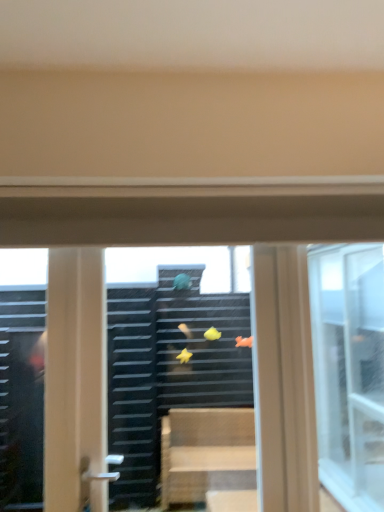
Question: Is transparent glass window at center, which ranks as the 2th window in left-to-right order, aimed at transparent glass window at center, the 1th window from the left?

Choices:
 (A) no
 (B) yes

Answer: (B)

Question: Is transparent glass window at center, acting as the first window starting from the right, touching transparent glass window at center, the 1th window from the left?

Choices:
 (A) no
 (B) yes

Answer: (A)

Question: From a real-world perspective, does transparent glass window at center, which ranks as the 2th window in left-to-right order, sit lower than transparent glass window at center, the 1th window from the left?

Choices:
 (A) no
 (B) yes

Answer: (A)

Question: Could transparent glass window at center, the 2th window from the right, be considered to be inside transparent glass window at center, acting as the first window starting from the right?

Choices:
 (A) no
 (B) yes

Answer: (A)

Question: From the image's perspective, is transparent glass window at center, acting as the first window starting from the right, located above transparent glass window at center, the 1th window from the left?

Choices:
 (A) no
 (B) yes

Answer: (B)

Question: Considering the relative sizes of transparent glass window at center, acting as the first window starting from the right, and transparent glass window at center, the 1th window from the left, in the image provided, is transparent glass window at center, acting as the first window starting from the right, bigger than transparent glass window at center, the 1th window from the left,?

Choices:
 (A) yes
 (B) no

Answer: (B)

Question: From the image's perspective, would you say transparent glass window at center, the 2th window from the right, is positioned over transparent plastic magnets at center?

Choices:
 (A) yes
 (B) no

Answer: (B)

Question: Is transparent glass window at center, the 2th window from the right, positioned before transparent plastic magnets at center?

Choices:
 (A) no
 (B) yes

Answer: (B)

Question: Can you confirm if transparent glass window at center, the 2th window from the right, is bigger than transparent plastic magnets at center?

Choices:
 (A) no
 (B) yes

Answer: (B)

Question: Is transparent glass window at center, the 1th window from the left, further to camera compared to transparent plastic magnets at center?

Choices:
 (A) yes
 (B) no

Answer: (B)

Question: Is transparent glass window at center, the 1th window from the left, to the left of transparent plastic magnets at center from the viewer's perspective?

Choices:
 (A) no
 (B) yes

Answer: (A)

Question: Would you say transparent glass window at center, the 1th window from the left, contains transparent plastic magnets at center?

Choices:
 (A) no
 (B) yes

Answer: (B)

Question: Does transparent glass window at center, the 2th window from the right, have a lesser width compared to transparent glass window at center, acting as the first window starting from the right?

Choices:
 (A) yes
 (B) no

Answer: (A)